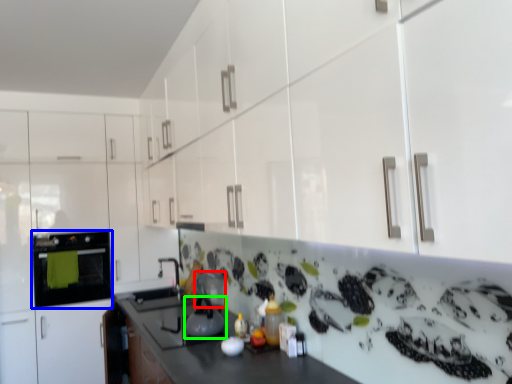
Question: Which object is positioned closest to appliance (highlighted by a red box)? Select from home appliance (highlighted by a blue box) and kitchen appliance (highlighted by a green box).

Choices:
 (A) home appliance
 (B) kitchen appliance

Answer: (B)